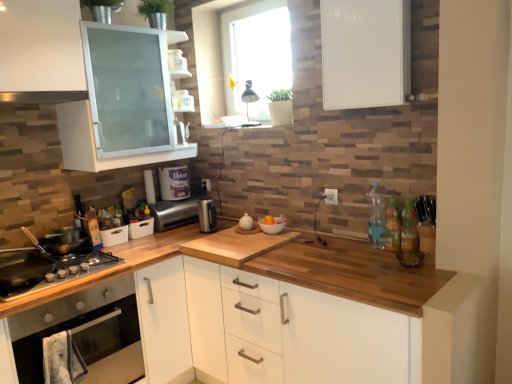
Question: Considering the relative sizes of clear plastic bottle at right, which is counted as the 3th bottle, starting from the right, and transparent glass window at upper center in the image provided, is clear plastic bottle at right, which is counted as the 3th bottle, starting from the right, wider than transparent glass window at upper center?

Choices:
 (A) no
 (B) yes

Answer: (A)

Question: Is clear plastic bottle at right, which is counted as the 3th bottle, starting from the right, turned away from transparent glass window at upper center?

Choices:
 (A) yes
 (B) no

Answer: (B)

Question: From the image's perspective, is clear plastic bottle at right, placed as the first bottle when sorted from left to right, on transparent glass window at upper center?

Choices:
 (A) yes
 (B) no

Answer: (B)

Question: Considering the relative sizes of clear plastic bottle at right, placed as the first bottle when sorted from left to right, and transparent glass window at upper center in the image provided, is clear plastic bottle at right, placed as the first bottle when sorted from left to right, bigger than transparent glass window at upper center?

Choices:
 (A) yes
 (B) no

Answer: (B)

Question: From a real-world perspective, is clear plastic bottle at right, which is counted as the 3th bottle, starting from the right, below transparent glass window at upper center?

Choices:
 (A) no
 (B) yes

Answer: (B)

Question: Is clear plastic bottle at right, placed as the first bottle when sorted from left to right, located outside transparent glass window at upper center?

Choices:
 (A) no
 (B) yes

Answer: (B)

Question: Considering the relative sizes of wooden at left and wooden countertop at center, the second cabinetry from the top, in the image provided, is wooden at left smaller than wooden countertop at center, the second cabinetry from the top,?

Choices:
 (A) yes
 (B) no

Answer: (B)

Question: Does wooden at left have a lesser height compared to wooden countertop at center, which ranks as the first cabinetry in bottom-to-top order?

Choices:
 (A) no
 (B) yes

Answer: (A)

Question: Considering the relative positions of wooden at left and wooden countertop at center, which ranks as the first cabinetry in bottom-to-top order, in the image provided, is wooden at left to the left of wooden countertop at center, which ranks as the first cabinetry in bottom-to-top order, from the viewer's perspective?

Choices:
 (A) no
 (B) yes

Answer: (B)

Question: From the image's perspective, is wooden at left located beneath wooden countertop at center, the second cabinetry from the top?

Choices:
 (A) no
 (B) yes

Answer: (B)

Question: Considering the relative sizes of wooden at left and wooden countertop at center, which ranks as the first cabinetry in bottom-to-top order, in the image provided, is wooden at left bigger than wooden countertop at center, which ranks as the first cabinetry in bottom-to-top order,?

Choices:
 (A) no
 (B) yes

Answer: (B)

Question: Does wooden at left have a greater height compared to wooden countertop at center, which ranks as the first cabinetry in bottom-to-top order?

Choices:
 (A) yes
 (B) no

Answer: (A)

Question: Are clear plastic bottle at right, placed as the first bottle when sorted from left to right, and satin silver exhaust hood at upper left far apart?

Choices:
 (A) yes
 (B) no

Answer: (A)